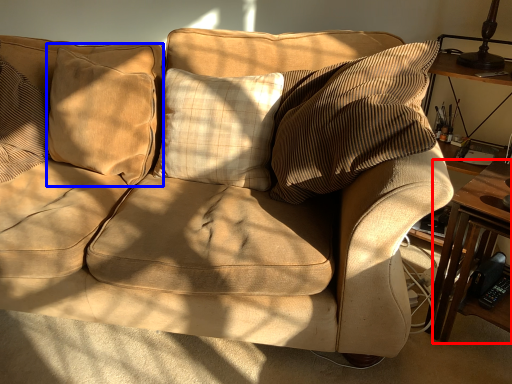
Question: Among these objects, which one is farthest to the camera, table (highlighted by a red box) or pillow (highlighted by a blue box)?

Choices:
 (A) table
 (B) pillow

Answer: (B)